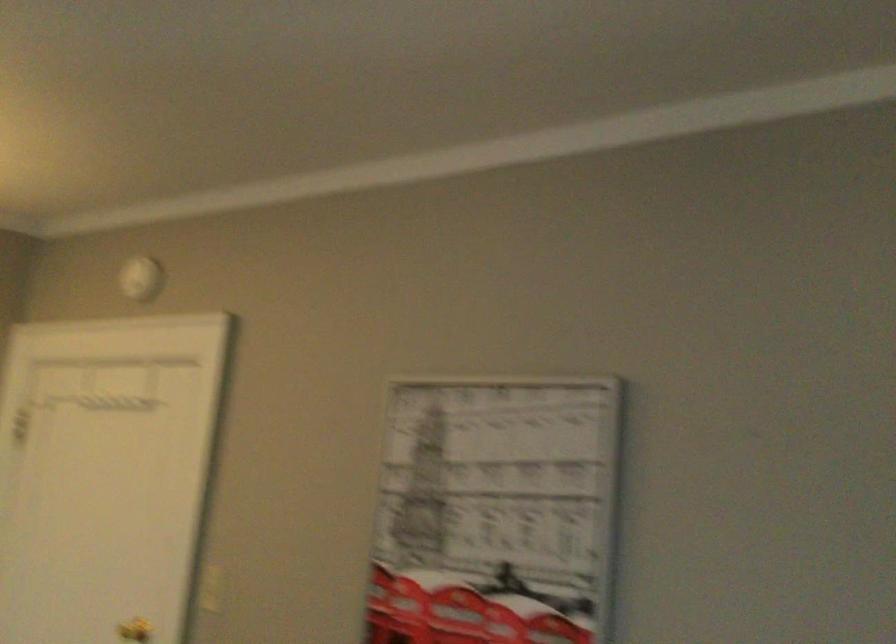
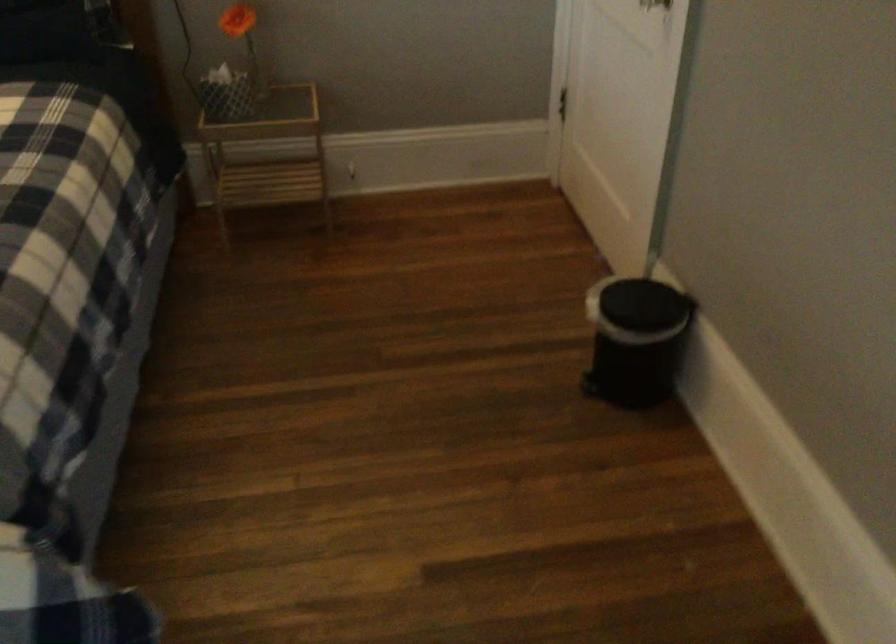
The images are taken continuously from a first-person perspective. In which direction is your viewpoint rotating?

The camera's rotation is toward left-down.